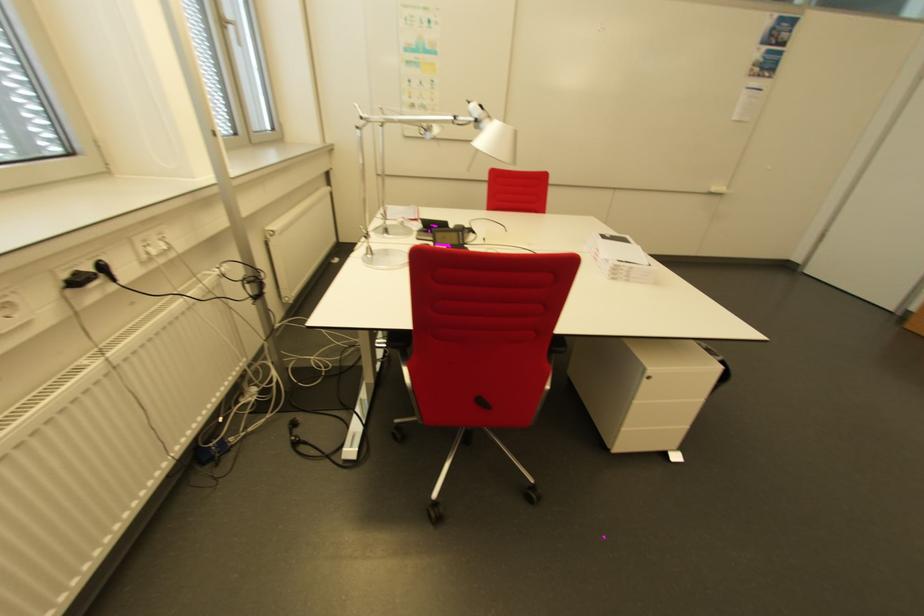
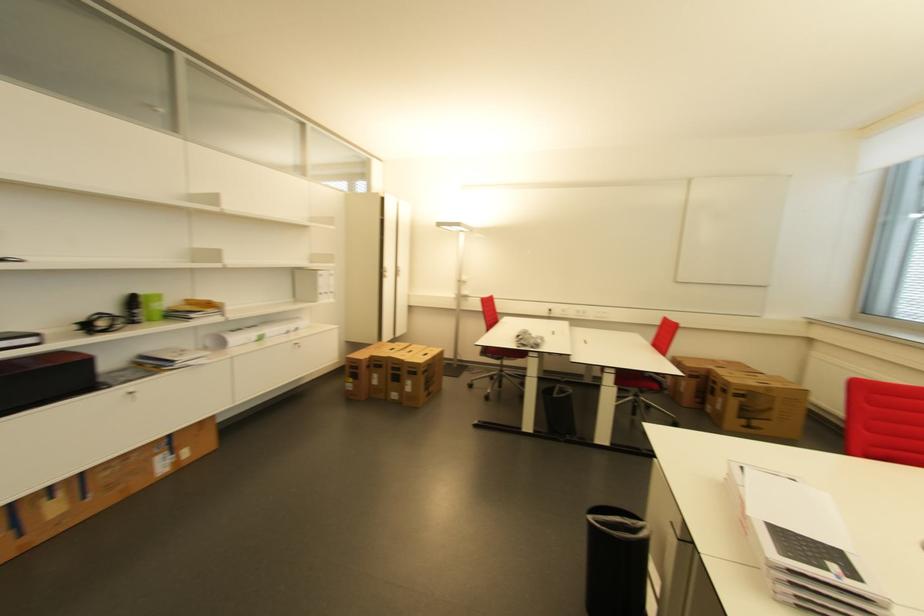
Question: I am providing you with two images of the same scene from different viewpoints. Which of the following objects are not visible in image2?

Choices:
 (A) chair adjustment lever
 (B) black trash can
 (C) magazine on shelf
 (D) green cup

Answer: (A)